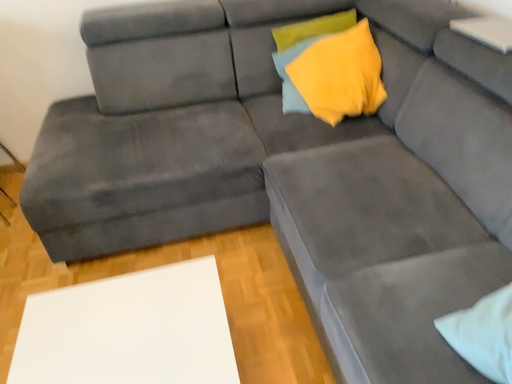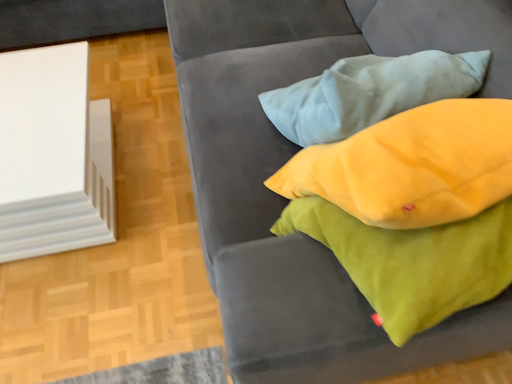
Question: How did the camera likely rotate when shooting the video?

Choices:
 (A) rotated downward
 (B) rotated upward

Answer: (A)